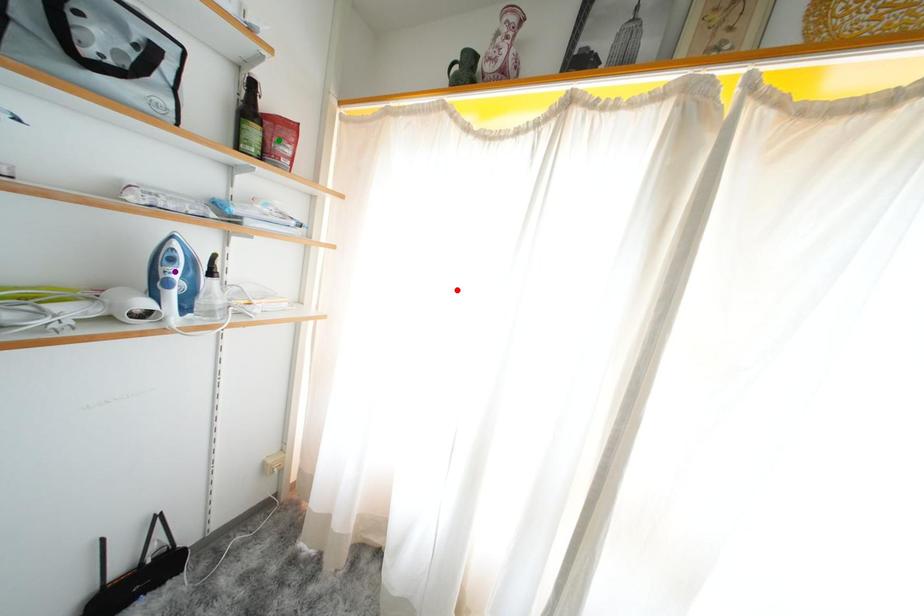
Order these from farthest to nearest:
- red point
- green point
- purple point

green point < purple point < red point